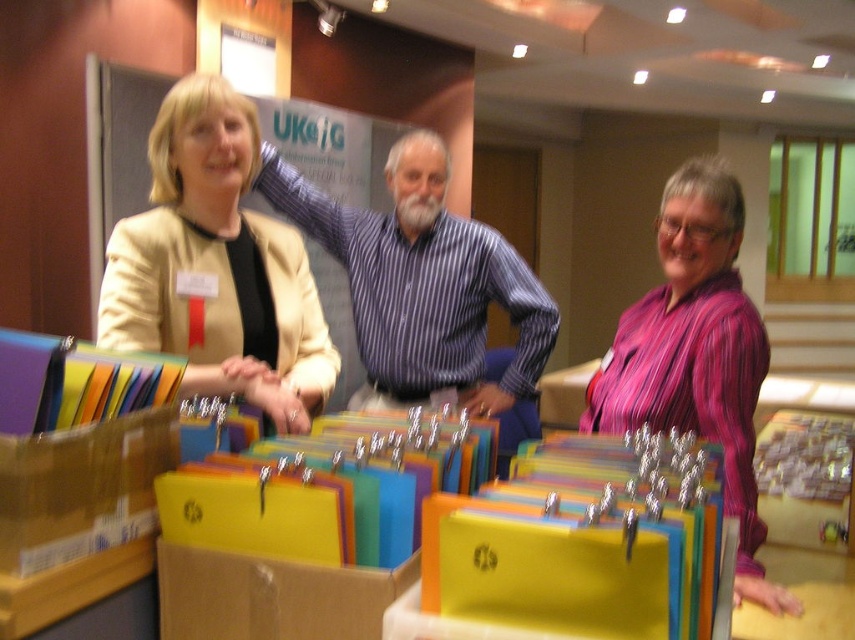
Question: Which object is closer to the camera taking this photo?

Choices:
 (A) matte beige blazer at center
 (B) striped cotton shirt at center

Answer: (A)

Question: Is matte beige blazer at center above purple striped shirt at center?

Choices:
 (A) yes
 (B) no

Answer: (A)

Question: Where is matte black jacket at center located in relation to matte beige blazer at center in the image?

Choices:
 (A) below
 (B) above

Answer: (B)

Question: Which point is farther from the camera taking this photo?

Choices:
 (A) (246, 236)
 (B) (452, 246)
 (C) (380, 381)

Answer: (C)

Question: Which of these objects is positioned farthest from the striped cotton shirt at center?

Choices:
 (A) matte black jacket at center
 (B) matte beige blazer at center
 (C) purple striped shirt at center

Answer: (C)

Question: In this image, where is matte beige blazer at center located relative to striped cotton shirt at center?

Choices:
 (A) below
 (B) above

Answer: (A)